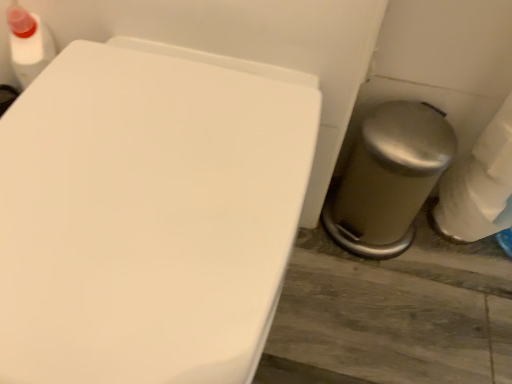
Question: Based on their sizes in the image, would you say white glossy toilet at center is bigger or smaller than satin silver trash can at lower right?

Choices:
 (A) small
 (B) big

Answer: (B)

Question: Is white glossy toilet at center inside or outside of satin silver trash can at lower right?

Choices:
 (A) outside
 (B) inside

Answer: (A)

Question: In the image, is white glossy toilet at center on the left side or the right side of satin silver trash can at lower right?

Choices:
 (A) right
 (B) left

Answer: (B)

Question: From the image's perspective, is satin silver trash can at lower right positioned above or below white glossy toilet at center?

Choices:
 (A) above
 (B) below

Answer: (A)

Question: Is satin silver trash can at lower right wider or thinner than white glossy toilet at center?

Choices:
 (A) thin
 (B) wide

Answer: (A)

Question: From their relative heights in the image, would you say satin silver trash can at lower right is taller or shorter than white glossy toilet at center?

Choices:
 (A) tall
 (B) short

Answer: (B)

Question: Considering the positions of point (400, 195) and point (14, 218), is point (400, 195) closer or farther from the camera than point (14, 218)?

Choices:
 (A) farther
 (B) closer

Answer: (A)